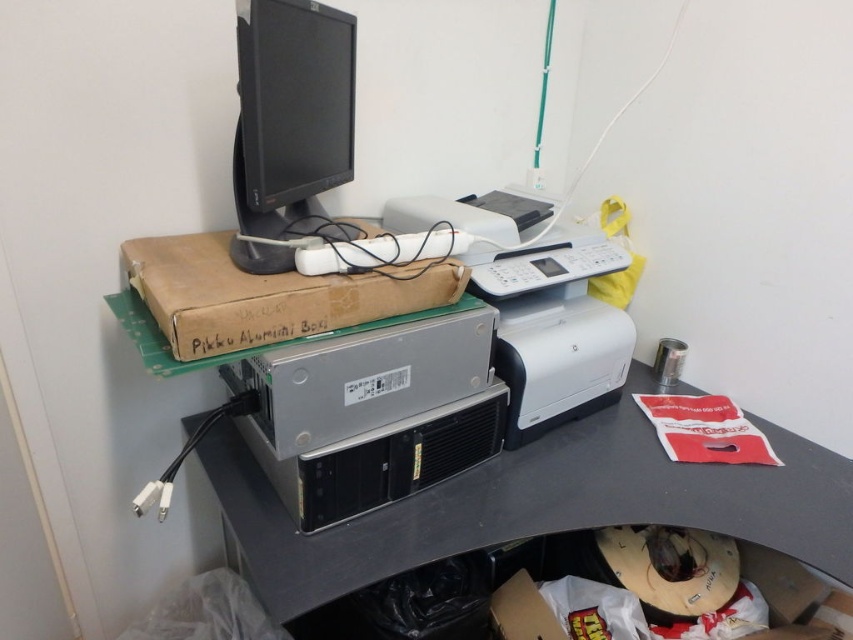
Which of these two, white plastic printer at center or brown cardboard box at center, stands taller?

white plastic printer at center

Does white plastic printer at center come behind brown cardboard box at center?

Yes, it is behind brown cardboard box at center.

You are a GUI agent. You are given a task and a screenshot of the screen. Output one action in this format:
    pyautogui.click(x=<x>, y=<y>)
    Task: Click on the white plastic printer at center
    
    Given the screenshot: What is the action you would take?
    pyautogui.click(x=537, y=304)

Is white plastic printer at center smaller than black glossy monitor at upper center?

No.

What are the coordinates of `white plastic printer at center` in the screenshot? It's located at (537, 304).

The width and height of the screenshot is (853, 640). What do you see at coordinates (537, 304) in the screenshot? I see `white plastic printer at center` at bounding box center [537, 304].

The width and height of the screenshot is (853, 640). I want to click on white plastic printer at center, so click(x=537, y=304).

The height and width of the screenshot is (640, 853). I want to click on silver metallic computer desk at center, so click(534, 504).

Who is more forward, (x=482, y=541) or (x=306, y=515)?

Positioned in front is point (x=306, y=515).

Is point (843, 513) farther from viewer compared to point (444, 358)?

Yes, it is.

You are a GUI agent. You are given a task and a screenshot of the screen. Output one action in this format:
    pyautogui.click(x=<x>, y=<y>)
    Task: Click on the silver metallic computer desk at center
    
    Given the screenshot: What is the action you would take?
    pyautogui.click(x=534, y=504)